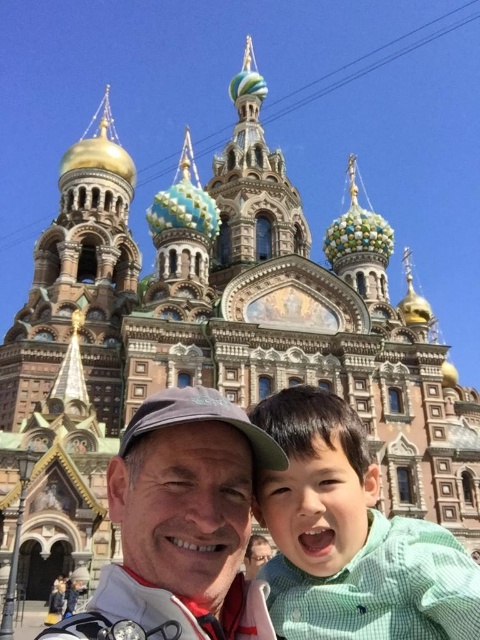
Who is positioned more to the right, green textured shirt at center or matte gray cap at center?

From the viewer's perspective, green textured shirt at center appears more on the right side.

Consider the image. Who is more forward, (334, 572) or (184, 536)?

Positioned in front is point (184, 536).

Which is behind, point (361, 429) or point (203, 570)?

Positioned behind is point (361, 429).

You are a GUI agent. You are given a task and a screenshot of the screen. Output one action in this format:
    pyautogui.click(x=<x>, y=<y>)
    Task: Click on the green textured shirt at center
    The height and width of the screenshot is (640, 480).
    Given the screenshot: What is the action you would take?
    pos(351,538)